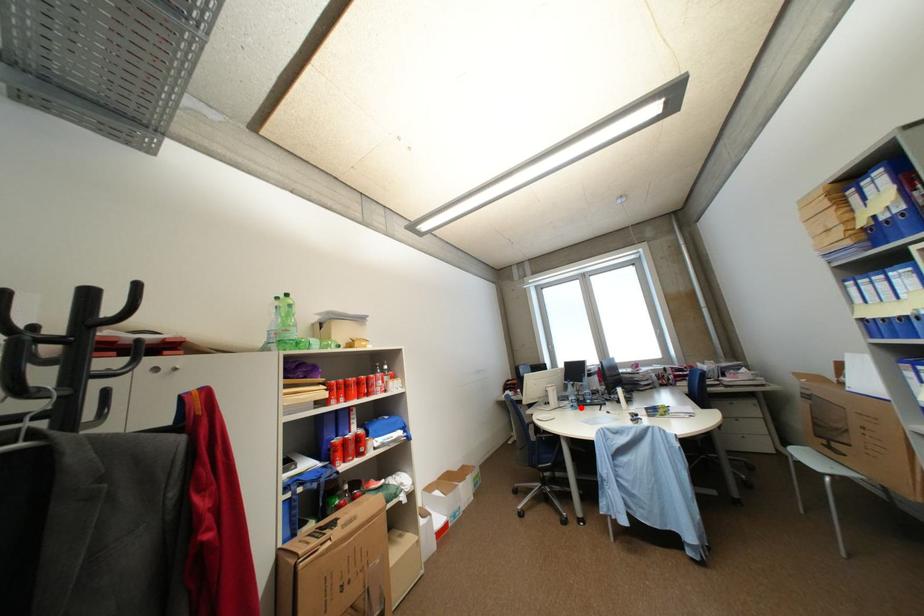
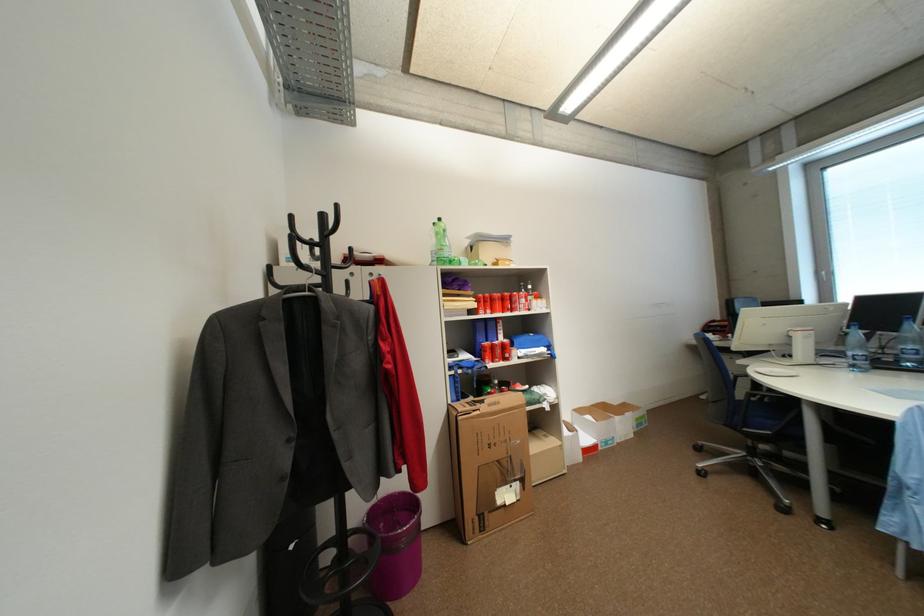
Question: I am providing you with two images of the same scene from different viewpoints. A red point is shown in image1. For the corresponding object point in image2, is it positioned nearer or farther from the camera?

Choices:
 (A) Nearer
 (B) Farther

Answer: (A)